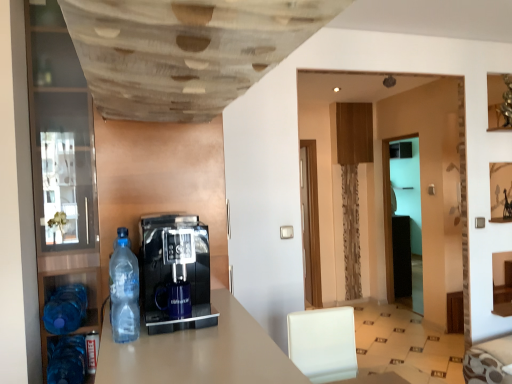
Question: Is wooden textured ceiling at upper center inside transparent glass door at center?

Choices:
 (A) yes
 (B) no

Answer: (B)

Question: Is transparent glass door at center oriented towards wooden textured ceiling at upper center?

Choices:
 (A) no
 (B) yes

Answer: (A)

Question: Can you confirm if transparent glass door at center is positioned to the right of wooden textured ceiling at upper center?

Choices:
 (A) yes
 (B) no

Answer: (A)

Question: Does transparent glass door at center lie behind wooden textured ceiling at upper center?

Choices:
 (A) yes
 (B) no

Answer: (A)

Question: Considering the relative sizes of transparent glass door at center and wooden textured ceiling at upper center in the image provided, is transparent glass door at center shorter than wooden textured ceiling at upper center?

Choices:
 (A) yes
 (B) no

Answer: (B)

Question: Can you confirm if transparent glass door at center is thinner than wooden textured ceiling at upper center?

Choices:
 (A) no
 (B) yes

Answer: (B)

Question: From a real-world perspective, does wooden textured ceiling at upper center sit lower than transparent glass pantry at left?

Choices:
 (A) yes
 (B) no

Answer: (B)

Question: Is wooden textured ceiling at upper center surrounding transparent glass pantry at left?

Choices:
 (A) no
 (B) yes

Answer: (A)

Question: Can you confirm if wooden textured ceiling at upper center is smaller than transparent glass pantry at left?

Choices:
 (A) yes
 (B) no

Answer: (A)

Question: From a real-world perspective, does wooden textured ceiling at upper center stand above transparent glass pantry at left?

Choices:
 (A) no
 (B) yes

Answer: (B)

Question: Is wooden textured ceiling at upper center not inside transparent glass pantry at left?

Choices:
 (A) yes
 (B) no

Answer: (A)

Question: From the image's perspective, is wooden textured ceiling at upper center on top of transparent glass pantry at left?

Choices:
 (A) no
 (B) yes

Answer: (B)

Question: Is transparent glass door at center positioned with its back to transparent plastic bottle at left, acting as the 1th bottle starting from the right?

Choices:
 (A) no
 (B) yes

Answer: (A)